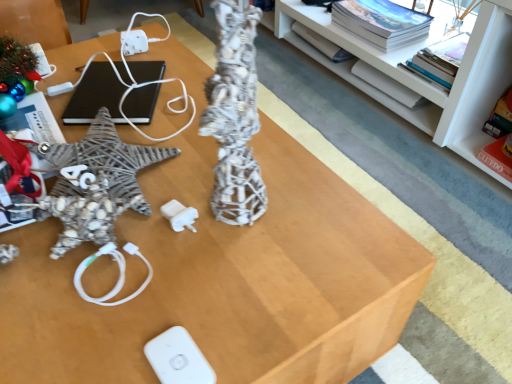
This screenshot has height=384, width=512. In order to click on vacant space behind white matte wii controller at lower center in this screenshot , I will do `click(190, 269)`.